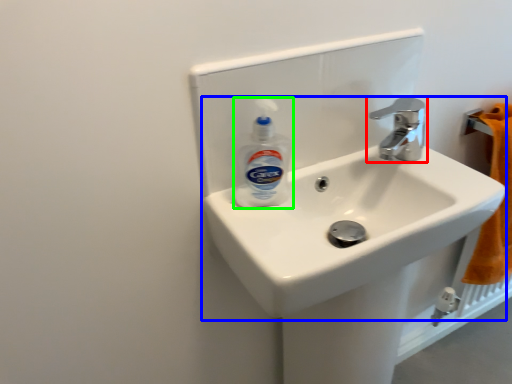
Question: Estimate the real-world distances between objects in this image. Which object is closer to tap (highlighted by a red box), sink (highlighted by a blue box) or cleaning product (highlighted by a green box)?

Choices:
 (A) sink
 (B) cleaning product

Answer: (A)